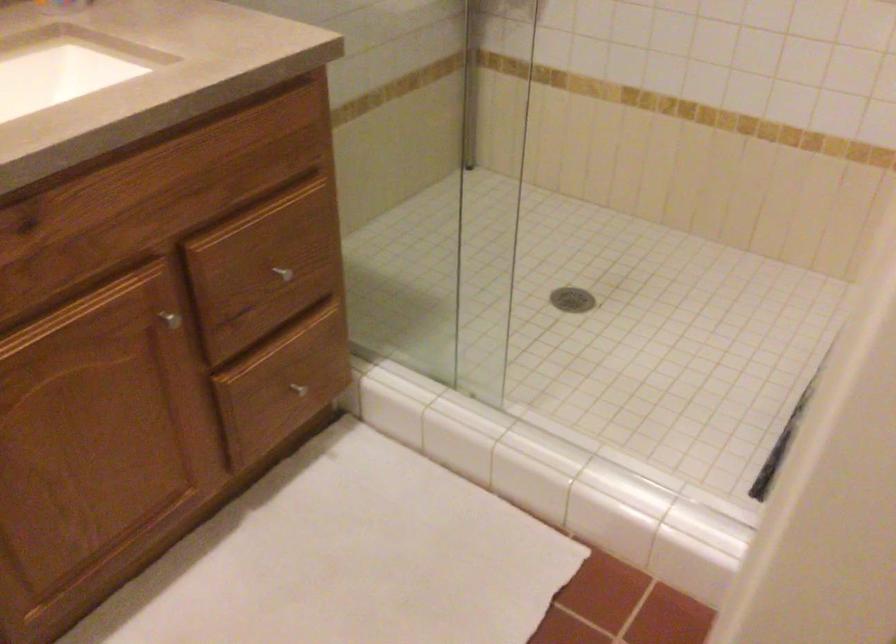
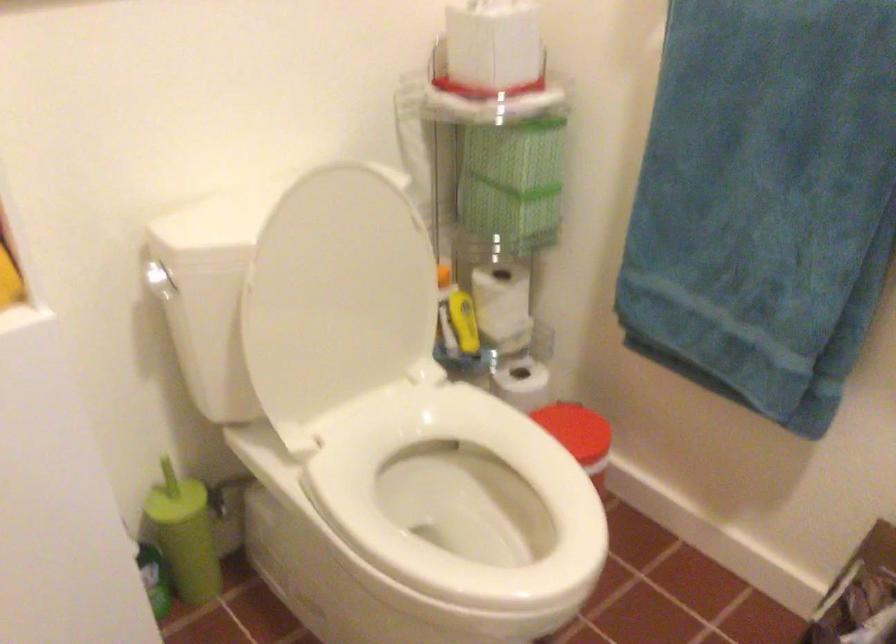
The first image is from the beginning of the video and the second image is from the end. How did the camera likely rotate when shooting the video?

The camera's rotation is toward left-down.